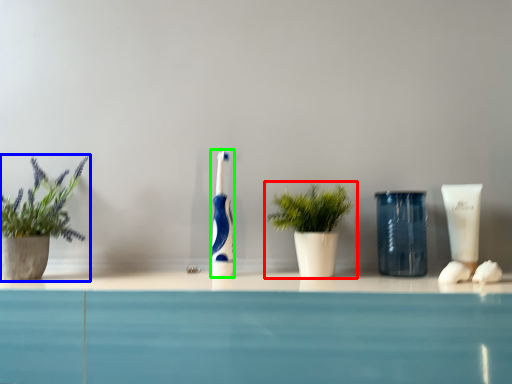
Question: Considering the real-world distances, which object is farthest from houseplant (highlighted by a red box)? houseplant (highlighted by a blue box) or toothbrush (highlighted by a green box)?

Choices:
 (A) houseplant
 (B) toothbrush

Answer: (A)